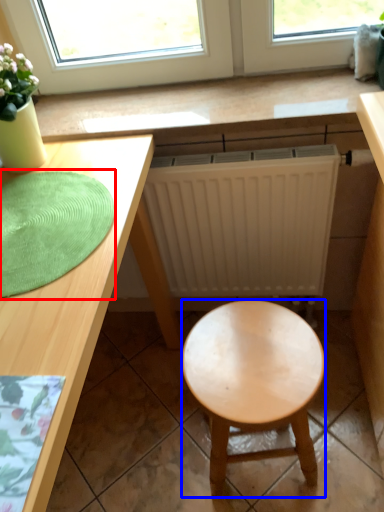
Question: Which object appears farthest to the camera in this image, mat (highlighted by a red box) or stool (highlighted by a blue box)?

Choices:
 (A) mat
 (B) stool

Answer: (B)